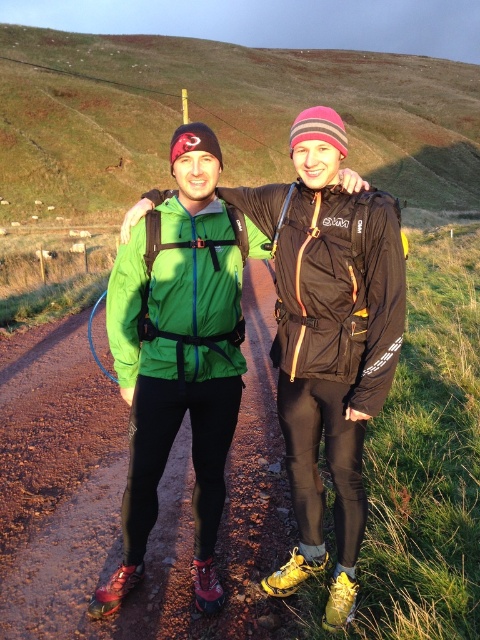
Is green fabric jacket at upper center closer to camera compared to green matte jacket at center?

No, green fabric jacket at upper center is behind green matte jacket at center.

Describe the element at coordinates (220, 116) in the screenshot. This screenshot has width=480, height=640. I see `green fabric jacket at upper center` at that location.

Who is more forward, [111,106] or [331,230]?

Point [331,230] is in front.

Where is `green fabric jacket at upper center`? Image resolution: width=480 pixels, height=640 pixels. green fabric jacket at upper center is located at coordinates (220, 116).